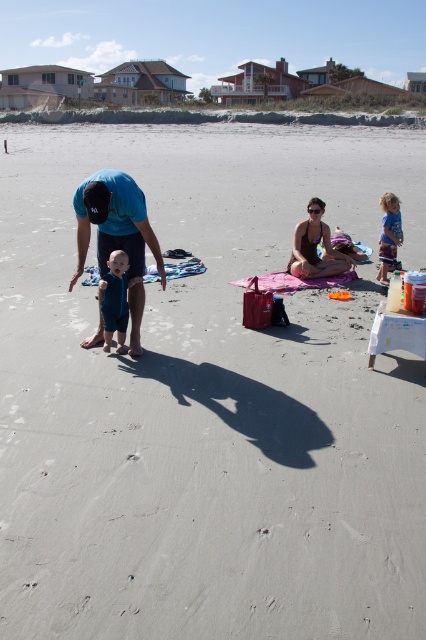
You are a photographer trying to capture a candid shot of the blue fabric shirt at center and the pink fabric bikini at center from a distance of 5 meters. Will you be able to frame both subjects in the same photo without moving your camera position?

The blue fabric shirt at center is 3.17 meters away from the pink fabric bikini at center. Since the distance between them is less than 5 meters, you can frame both subjects in the same photo without moving your camera position.

You are a lifeguard on duty and need to reach both the pink fabric bikini at center and the blue denim shorts at center quickly. Based on the distance between them, can you estimate how much time it would take to run from one to the other if your average running speed is 5 meters per second?

The distance between the pink fabric bikini at center and blue denim shorts at center is 3.25 meters. At an average running speed of 5 meters per second, it would take approximately 0.65 seconds to run between them.

You are a photographer trying to capture a candid shot of the pink fabric bikini at center and the blue denim shorts at center. Which object should you focus on first if you want to photograph them in order from left to right?

The blue denim shorts at center should be focused on first since it is to the left of the pink fabric bikini at center.